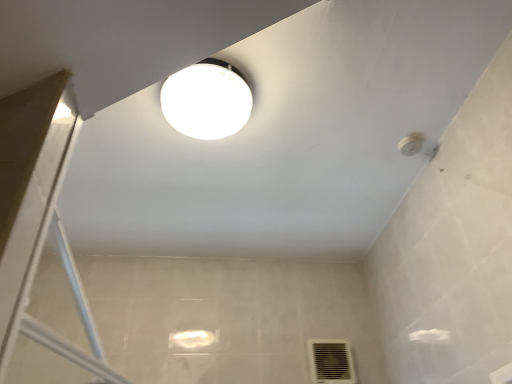
Question: From a real-world perspective, is black plastic air conditioning at lower right positioned above or below white glossy lamp at upper center?

Choices:
 (A) below
 (B) above

Answer: (A)

Question: Is black plastic air conditioning at lower right inside the boundaries of white glossy lamp at upper center, or outside?

Choices:
 (A) outside
 (B) inside

Answer: (A)

Question: Is black plastic air conditioning at lower right in front of or behind white glossy lamp at upper center in the image?

Choices:
 (A) behind
 (B) front

Answer: (A)

Question: Considering the positions of point (215, 87) and point (345, 377), is point (215, 87) closer or farther from the camera than point (345, 377)?

Choices:
 (A) closer
 (B) farther

Answer: (A)

Question: Do you think white glossy lamp at upper center is within black plastic air conditioning at lower right, or outside of it?

Choices:
 (A) inside
 (B) outside

Answer: (B)

Question: From the image's perspective, is white glossy lamp at upper center located above or below black plastic air conditioning at lower right?

Choices:
 (A) above
 (B) below

Answer: (A)

Question: Considering their positions, is white glossy lamp at upper center located in front of or behind black plastic air conditioning at lower right?

Choices:
 (A) front
 (B) behind

Answer: (A)